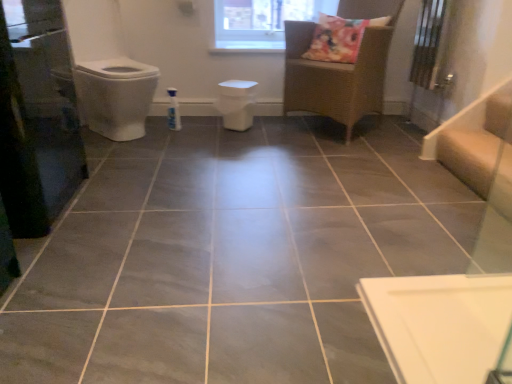
Question: From a real-world perspective, is white matte toilet bowl at center above or below woven rattan chair at upper center?

Choices:
 (A) above
 (B) below

Answer: (B)

Question: Is white matte toilet bowl at center bigger or smaller than woven rattan chair at upper center?

Choices:
 (A) big
 (B) small

Answer: (B)

Question: Which is farther from the beige wood stairwell at right?

Choices:
 (A) white matte toilet bowl at center
 (B) transparent glass window at upper center
 (C) woven rattan chair at upper center
 (D) transparent glass screen door at left

Answer: (D)

Question: Which is nearer to the woven rattan chair at upper center?

Choices:
 (A) white matte toilet bowl at center
 (B) beige wood stairwell at right
 (C) transparent glass screen door at left
 (D) transparent glass window at upper center

Answer: (A)